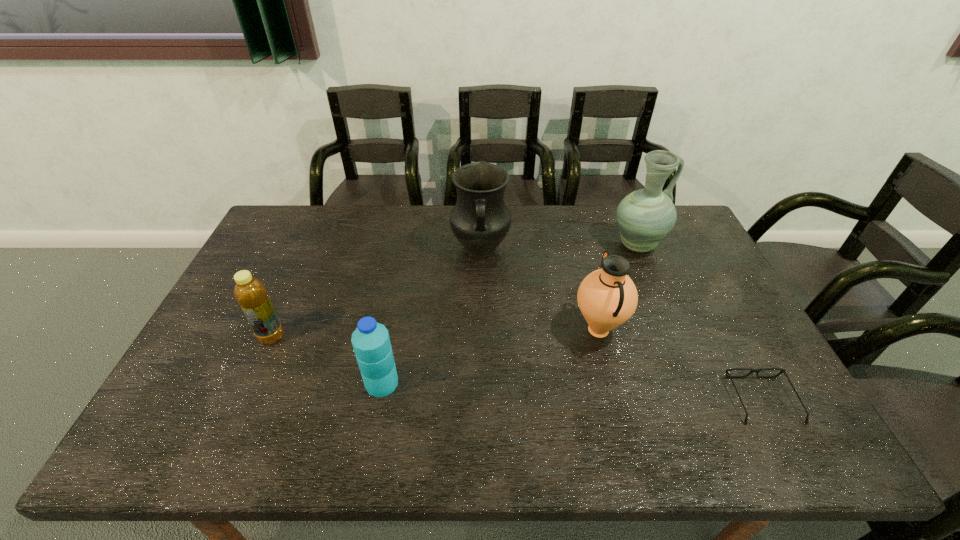
Identify the location of vacant space that satisfies the following two spatial constraints: 1. on the handle side of the leftmost pitcher; 2. on the right side of the third object from right to left. This screenshot has height=540, width=960. (481, 330).

Locate an element on the screen. Image resolution: width=960 pixels, height=540 pixels. free space in the image that satisfies the following two spatial constraints: 1. on the back side of the leftmost object; 2. on the right side of the second pitcher from left to right is located at coordinates (275, 330).

Locate an element on the screen. This screenshot has height=540, width=960. vacant region that satisfies the following two spatial constraints: 1. on the handle side of the rightmost pitcher; 2. on the front-facing side of the spectacles is located at coordinates (701, 400).